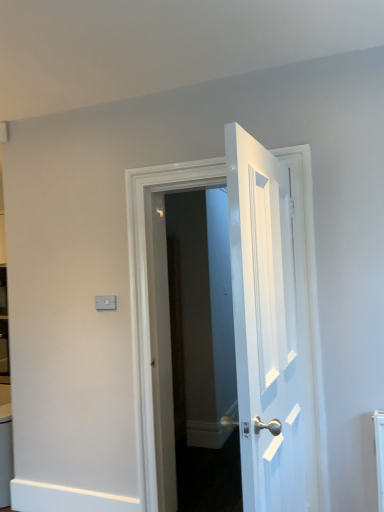
Question: From a real-world perspective, relative to white glossy door at center, the second door viewed from the back, is white wooden door at center, the second door from the front, vertically above or below?

Choices:
 (A) above
 (B) below

Answer: (B)

Question: Does point coord(137,324) appear closer or farther from the camera than point coord(231,262)?

Choices:
 (A) closer
 (B) farther

Answer: (B)

Question: From the image's perspective, is white wooden door at center, the second door from the front, positioned above or below white glossy door at center, the second door viewed from the back?

Choices:
 (A) below
 (B) above

Answer: (A)

Question: Would you say white glossy door at center, the second door viewed from the back, is to the left or to the right of white wooden door at center, the 1th door when ordered from back to front, in the picture?

Choices:
 (A) left
 (B) right

Answer: (B)

Question: From a real-world perspective, is white glossy door at center, the second door viewed from the back, positioned above or below white wooden door at center, the 1th door when ordered from back to front?

Choices:
 (A) below
 (B) above

Answer: (B)

Question: In terms of width, does white glossy door at center, the first door from the front, look wider or thinner when compared to white wooden door at center, the second door from the front?

Choices:
 (A) thin
 (B) wide

Answer: (A)

Question: From the image's perspective, is white glossy door at center, the first door from the front, above or below white wooden door at center, the second door from the front?

Choices:
 (A) above
 (B) below

Answer: (A)